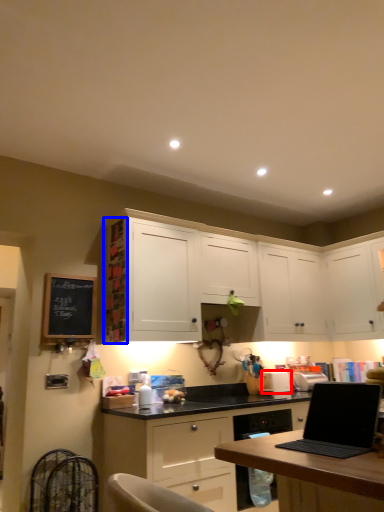
Question: Which object is closer to the camera taking this photo, appliance (highlighted by a red box) or shelf (highlighted by a blue box)?

Choices:
 (A) appliance
 (B) shelf

Answer: (B)